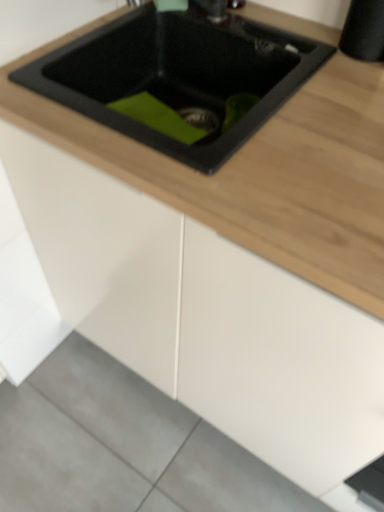
This screenshot has width=384, height=512. I want to click on free space above gray concrete at lower left (from a real-world perspective), so click(x=114, y=448).